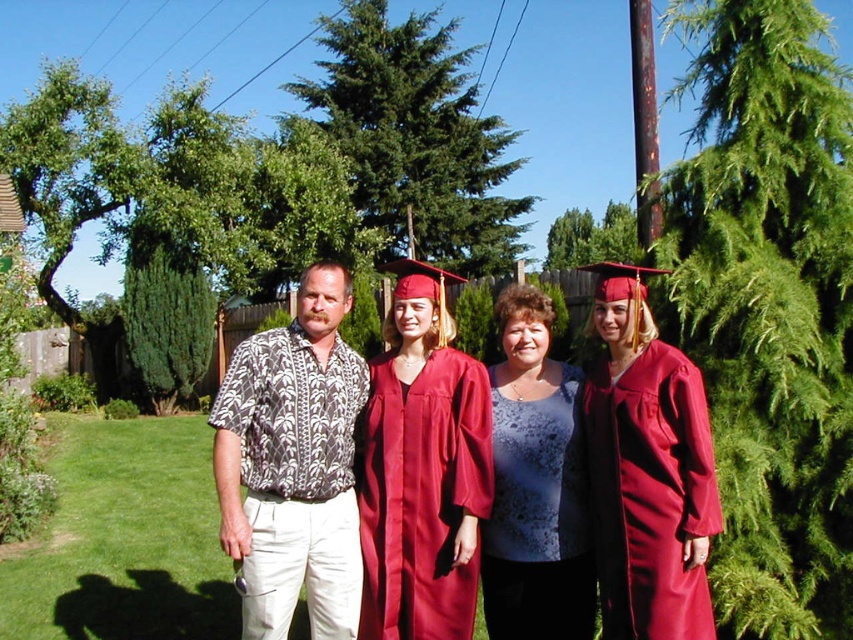
You are a photographer positioned at the center of the scene. You want to take a photo focusing on the brown printed shirt at left. Which direction should you move to get the shirt into the frame?

The brown printed shirt at left is located at point (293,465), so you should move to the left to center it in your frame.

You are a photographer taking a picture of the two graduates in their gowns. You want to ensure both the matte red gown at center and the maroon satin gown at center are clearly visible in the photo. Given their current positions, which gown might be partially hidden and why?

The maroon satin gown at center might be partially hidden because it is positioned behind the matte red gown at center, potentially blocking part of it from view.